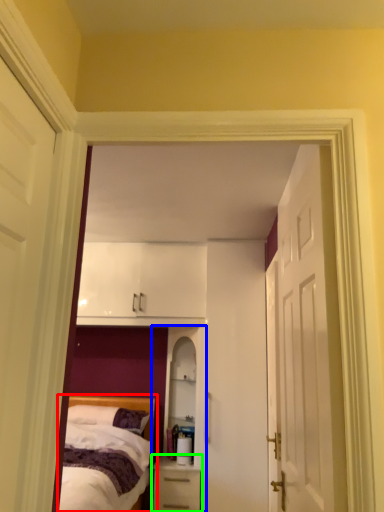
Question: Which object is the closest to the bed (highlighted by a red box)? Choose among these: dresser (highlighted by a blue box) or nightstand (highlighted by a green box).

Choices:
 (A) dresser
 (B) nightstand

Answer: (B)